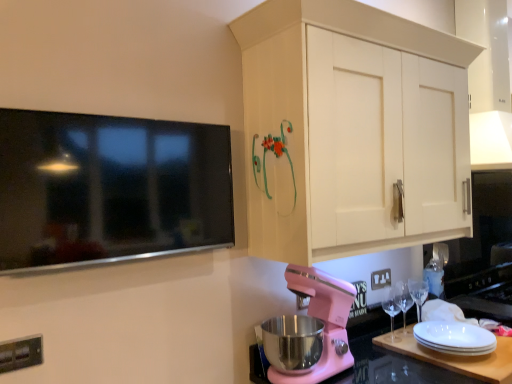
Question: From their relative heights in the image, would you say transparent glass wine glass at lower right, which is counted as the 2th wine glass, starting from the left, is taller or shorter than pink matte countertop at lower center?

Choices:
 (A) short
 (B) tall

Answer: (A)

Question: Visually, is transparent glass wine glass at lower right, which is counted as the 2th wine glass, starting from the left, positioned to the left or to the right of pink matte countertop at lower center?

Choices:
 (A) right
 (B) left

Answer: (A)

Question: Estimate the real-world distances between objects in this image. Which object is closer to the white plastic electric outlet at lower center, which is counted as the first electric outlet, starting from the back?

Choices:
 (A) metallic silver electric outlet at lower left, placed as the second electric outlet when sorted from right to left
 (B) pink matte countertop at lower center
 (C) pink matte stand mixer at lower center
 (D) white matte cabinet at upper right
 (E) transparent glass wine glass at lower right, the 1th wine glass from the right

Answer: (E)

Question: Which object is positioned farthest from the pink matte countertop at lower center?

Choices:
 (A) metallic silver electric outlet at lower left, the 2th electric outlet positioned from the back
 (B) transparent glass wine glass at lower right, which is counted as the 2th wine glass, starting from the left
 (C) white matte cabinet at upper right
 (D) pink matte stand mixer at lower center
 (E) clear glass wine glass at lower right, acting as the 1th wine glass starting from the left

Answer: (A)